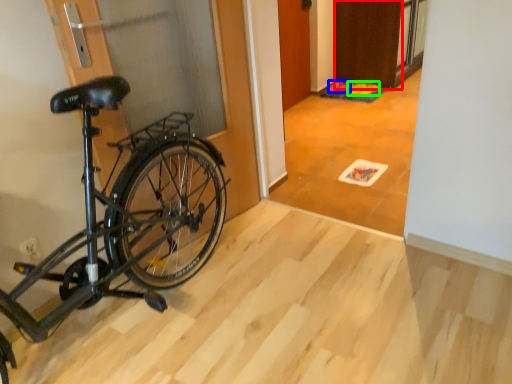
Question: Based on their relative distances, which object is nearer to door (highlighted by a red box)? Choose from walking shoe (highlighted by a blue box) and walking shoe (highlighted by a green box).

Choices:
 (A) walking shoe
 (B) walking shoe

Answer: (B)